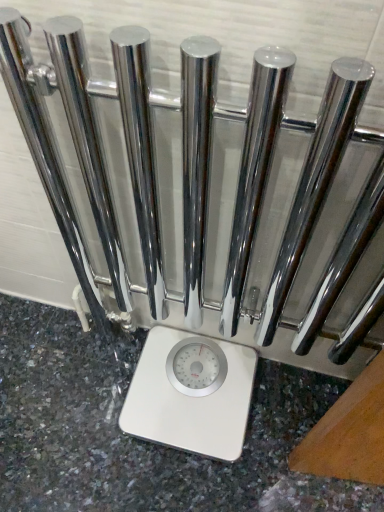
Locate an element on the screen. The image size is (384, 512). vacant area on top of white glossy scale at center (from a real-world perspective) is located at coordinates (188, 379).